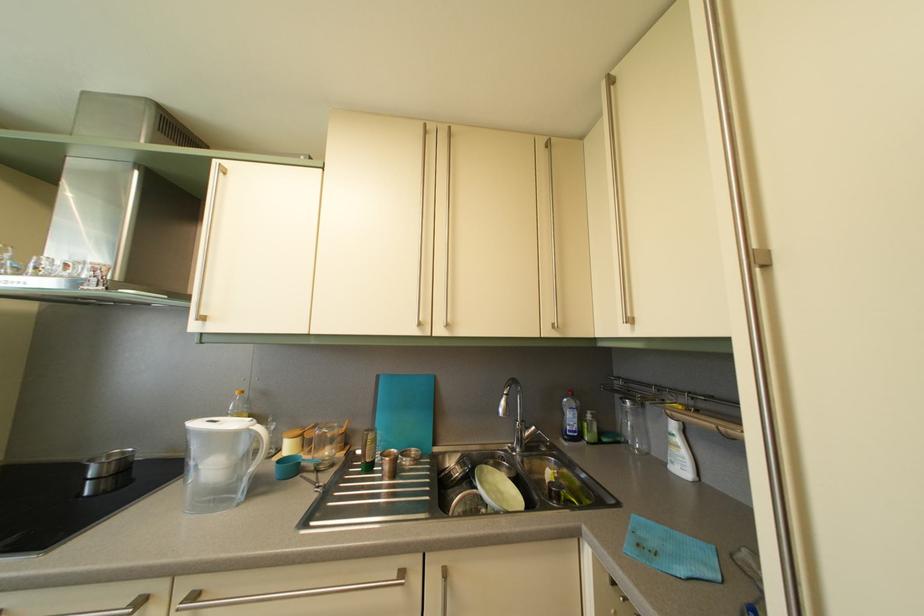
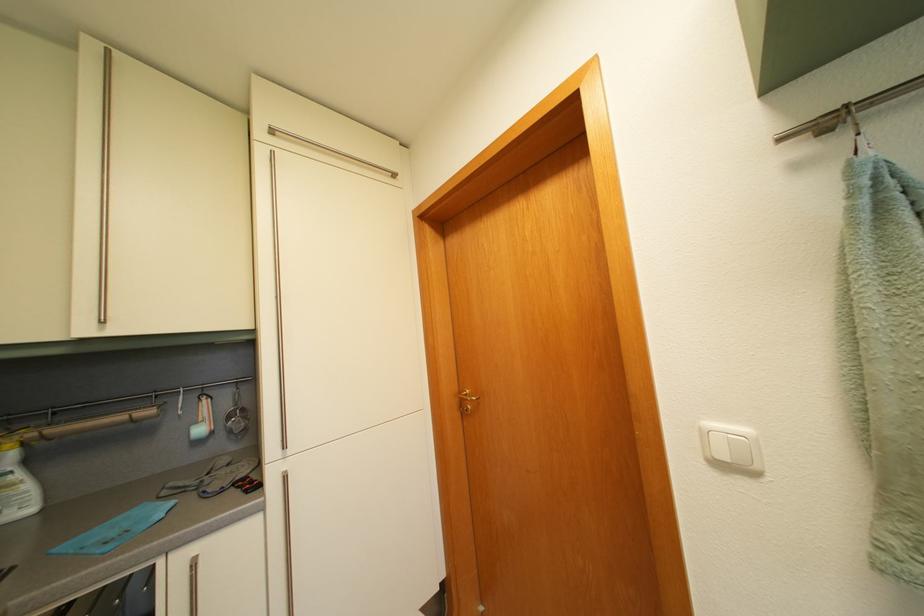
Where in the second image is the point corresponding to (687,448) from the first image?

(26, 484)